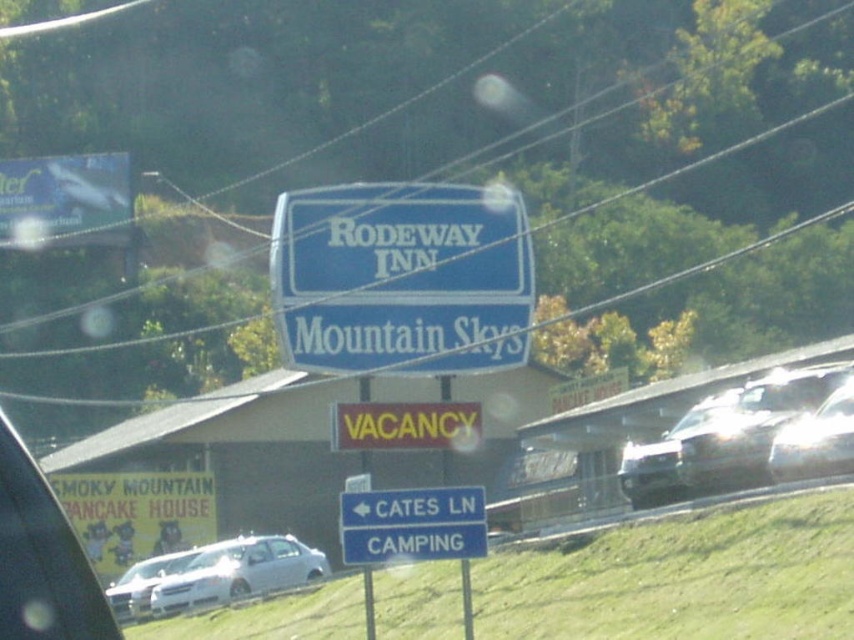
Question: Is blue plastic sign at center positioned at the back of clear glass car window at lower center?

Choices:
 (A) no
 (B) yes

Answer: (A)

Question: Among these objects, which one is nearest to the camera?

Choices:
 (A) blue plastic sign at lower center
 (B) blue plastic sign at center

Answer: (A)

Question: Among these objects, which one is farthest from the camera?

Choices:
 (A) shiny silver sedan at center
 (B) white matte sedan at lower left
 (C) silver metallic sedan at lower left

Answer: (B)

Question: Is silver metallic sedan at lower left to the left of clear glass car window at lower center from the viewer's perspective?

Choices:
 (A) yes
 (B) no

Answer: (A)

Question: Which point is closer to the camera?

Choices:
 (A) (640, 476)
 (B) (493, 317)
 (C) (173, 557)

Answer: (B)

Question: Is blue plastic sign at center to the right of silver metallic sedan at lower left from the viewer's perspective?

Choices:
 (A) yes
 (B) no

Answer: (A)